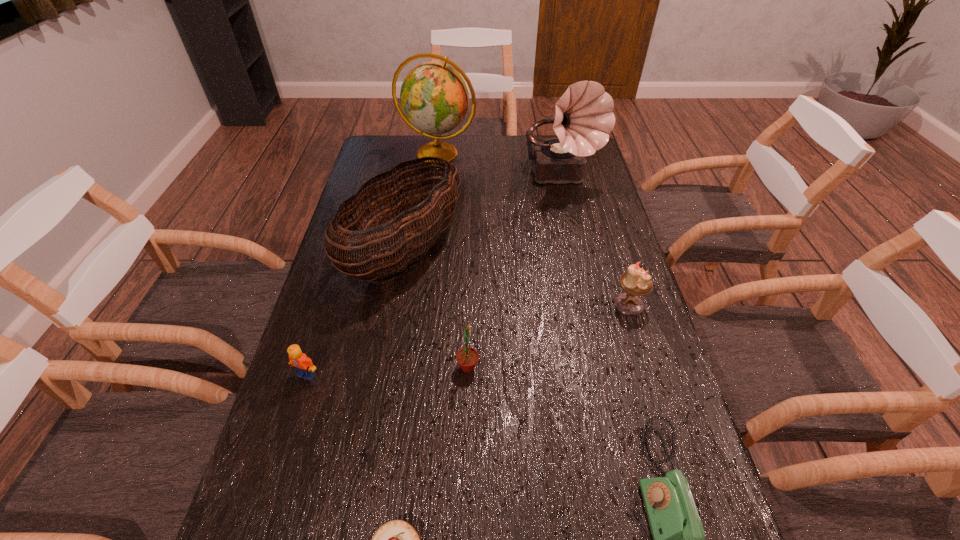
Locate an element on the screen. object at the far right corner is located at coordinates (584, 118).

In the image, there is a desktop. At what (x,y) coordinates should I click in order to perform the action: click on free space at the left edge. Please return your answer as a coordinate pair (x, y). Image resolution: width=960 pixels, height=540 pixels. Looking at the image, I should click on (316, 406).

Locate an element on the screen. The height and width of the screenshot is (540, 960). vacant space at the right edge of the desktop is located at coordinates (629, 344).

Identify the location of free space between the third tallest object and the candle holder. (517, 277).

I want to click on free point between the sunflower and the third shortest object, so click(x=387, y=371).

Image resolution: width=960 pixels, height=540 pixels. What are the coordinates of `free space between the sunflower and the record player` in the screenshot? It's located at (516, 273).

You are a GUI agent. You are given a task and a screenshot of the screen. Output one action in this format:
    pyautogui.click(x=<x>, y=<y>)
    Task: Click on the free space between the sunflower and the sixth tallest object
    
    Given the screenshot: What is the action you would take?
    pyautogui.click(x=387, y=371)

Locate an element on the screen. The height and width of the screenshot is (540, 960). object that is the third nearest to the record player is located at coordinates (635, 282).

Locate an element on the screen. object that is the second closest to the globe is located at coordinates (406, 241).

At what (x,y) coordinates should I click in order to perform the action: click on vacant position in the image that satisfies the following two spatial constraints: 1. on the face of the sunflower; 2. on the front-facing side of the third shortest object. Please return your answer as a coordinate pair (x, y). Looking at the image, I should click on (x=468, y=375).